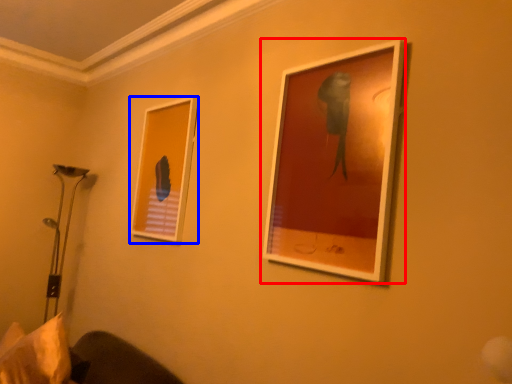
Question: Which point is further to the camera, picture frame (highlighted by a red box) or picture frame (highlighted by a blue box)?

Choices:
 (A) picture frame
 (B) picture frame

Answer: (B)